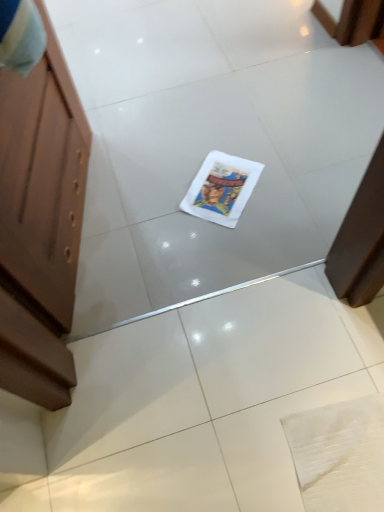
At what (x,y) coordinates should I click in order to perform the action: click on vacant region to the left of white paper comic book at center. Please return your answer as a coordinate pair (x, y). Looking at the image, I should click on (167, 196).